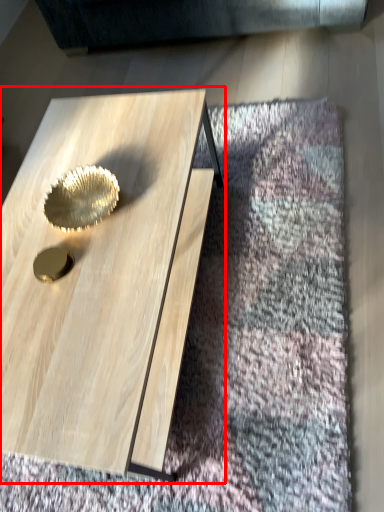
Question: From the image, what is the correct spatial relationship of coffee table (annotated by the red box) in relation to gold?

Choices:
 (A) right
 (B) left

Answer: (A)